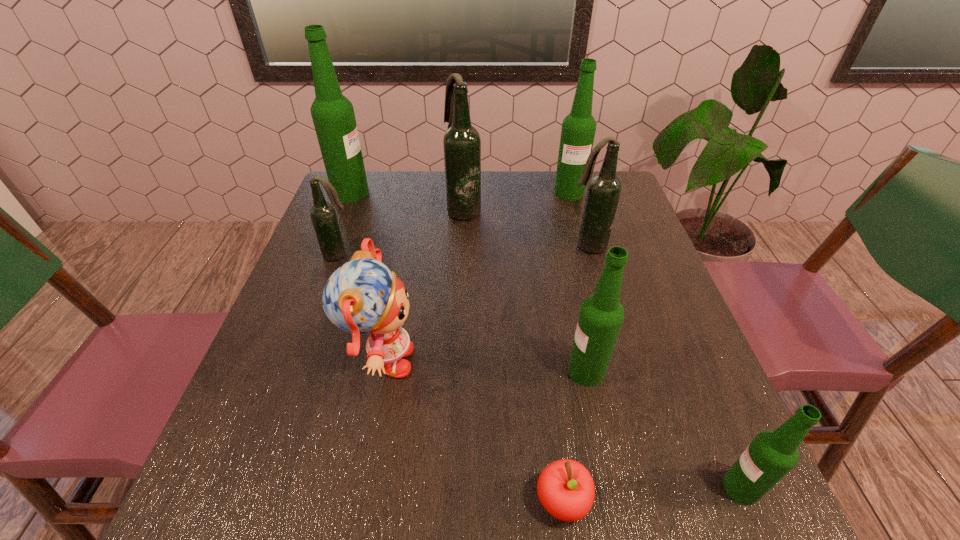
Select which green beer bottle is the second closest to the second nearest beer bottle. Please provide its 2D coordinates. Your answer should be formatted as a tuple, i.e. [(x, y)], where the tuple contains the x and y coordinates of a point satisfying the conditions above.

[(578, 130)]

Where is `the fourth closest green beer bottle to the second smallest dark beer bottle`? Image resolution: width=960 pixels, height=540 pixels. the fourth closest green beer bottle to the second smallest dark beer bottle is located at coordinates (x=333, y=115).

The height and width of the screenshot is (540, 960). I want to click on dark beer bottle that stands as the closest to the second biggest green beer bottle, so click(x=603, y=193).

The image size is (960, 540). I want to click on dark beer bottle that is the second nearest to the rightmost dark beer bottle, so click(x=323, y=215).

At what (x,y) coordinates should I click in order to perform the action: click on vacant region that satisfies the following two spatial constraints: 1. on the front side of the rightmost dark beer bottle; 2. on the face of the third object from left to right. Please return your answer as a coordinate pair (x, y). The width and height of the screenshot is (960, 540). Looking at the image, I should click on (619, 362).

Identify the location of free spot that satisfies the following two spatial constraints: 1. on the back side of the apple; 2. on the label of the tallest beer bottle. The image size is (960, 540). (522, 193).

You are a GUI agent. You are given a task and a screenshot of the screen. Output one action in this format:
    pyautogui.click(x=<x>, y=<y>)
    Task: Click on the vacant region that satisfies the following two spatial constraints: 1. on the label of the red apple; 2. on the right side of the tallest object
    
    Given the screenshot: What is the action you would take?
    pyautogui.click(x=229, y=501)

Where is `free region that satisfies the following two spatial constraints: 1. on the face of the third object from left to right; 2. on the right side of the apple`? The image size is (960, 540). free region that satisfies the following two spatial constraints: 1. on the face of the third object from left to right; 2. on the right side of the apple is located at coordinates (354, 501).

At what (x,y) coordinates should I click in order to perform the action: click on vacant space that satisfies the following two spatial constraints: 1. on the label of the third smallest green beer bottle; 2. on the label of the biggest green beer bottle. Please return your answer as a coordinate pair (x, y). The width and height of the screenshot is (960, 540). Looking at the image, I should click on (569, 193).